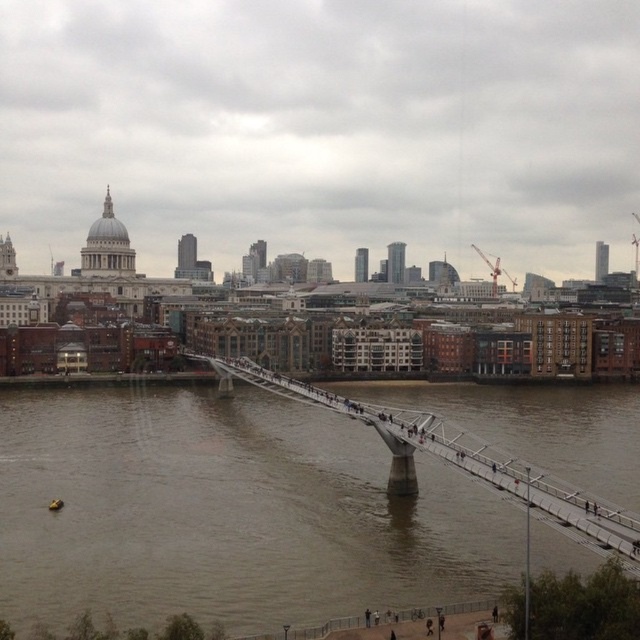
Question: Is brown muddy water at center in front of metallic gray bridge at center?

Choices:
 (A) yes
 (B) no

Answer: (B)

Question: In this image, where is brown muddy water at center located relative to metallic gray bridge at center?

Choices:
 (A) left
 (B) right

Answer: (A)

Question: Is brown muddy water at center to the right of metallic gray bridge at center from the viewer's perspective?

Choices:
 (A) yes
 (B) no

Answer: (B)

Question: Which of the following is the closest to the observer?

Choices:
 (A) metallic gray bridge at center
 (B) brown muddy water at center

Answer: (A)

Question: Which point appears farthest from the camera in this image?

Choices:
 (A) (429, 429)
 (B) (285, 556)

Answer: (A)

Question: Which object is farther from the camera taking this photo?

Choices:
 (A) metallic gray bridge at center
 (B) brown muddy water at center

Answer: (B)